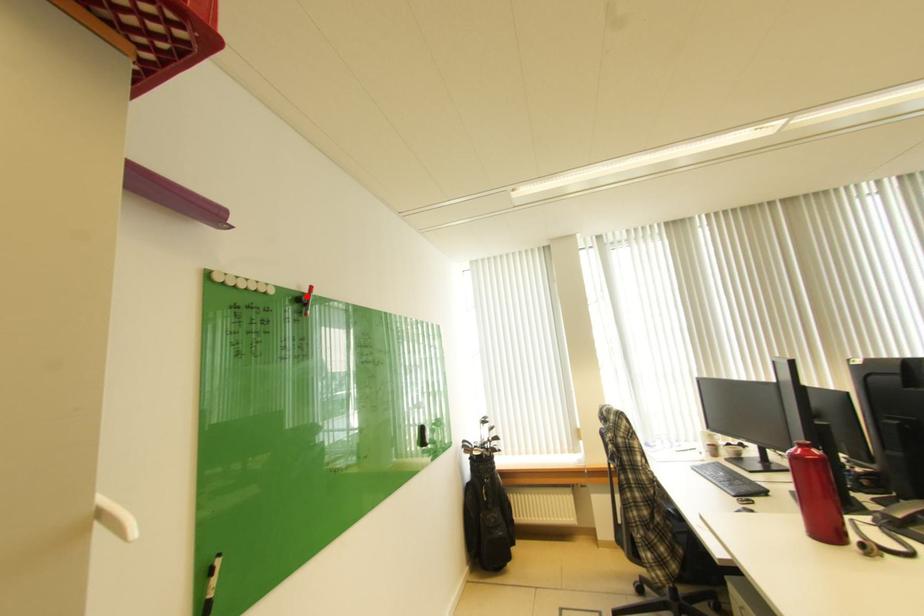
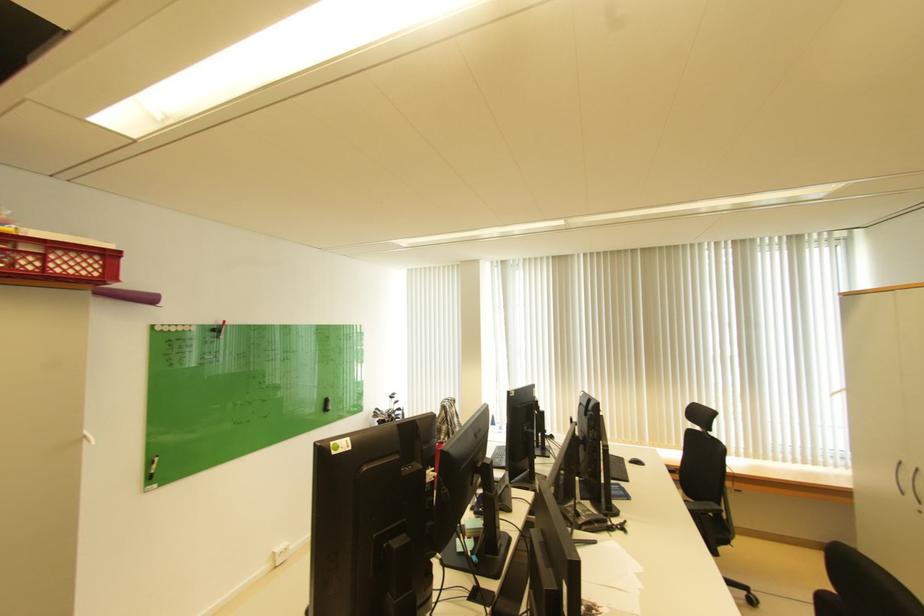
The point at the highlighted location is marked in the first image. Where is the corresponding point in the second image?

(223, 329)